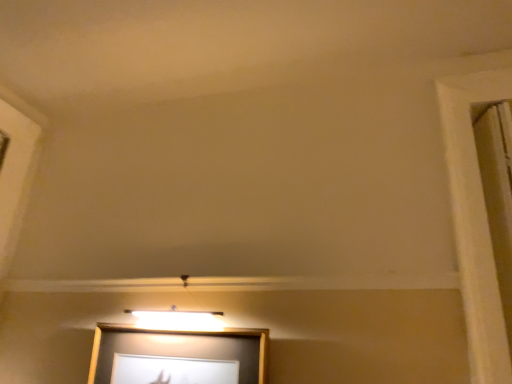
Question: Based on their positions, is white wood window frame at right located to the left or right of wooden picture frame at center?

Choices:
 (A) right
 (B) left

Answer: (A)

Question: From a real-world perspective, is white wood window frame at right physically located above or below wooden picture frame at center?

Choices:
 (A) above
 (B) below

Answer: (A)

Question: Does point (477, 327) appear closer or farther from the camera than point (151, 340)?

Choices:
 (A) farther
 (B) closer

Answer: (B)

Question: Looking at the image, does wooden picture frame at center seem bigger or smaller compared to white wood window frame at right?

Choices:
 (A) small
 (B) big

Answer: (B)

Question: From a real-world perspective, relative to white wood window frame at right, is wooden picture frame at center vertically above or below?

Choices:
 (A) below
 (B) above

Answer: (A)

Question: From the image's perspective, is wooden picture frame at center positioned above or below white wood window frame at right?

Choices:
 (A) above
 (B) below

Answer: (B)

Question: Considering the positions of wooden picture frame at center and white wood window frame at right in the image, is wooden picture frame at center wider or thinner than white wood window frame at right?

Choices:
 (A) thin
 (B) wide

Answer: (B)